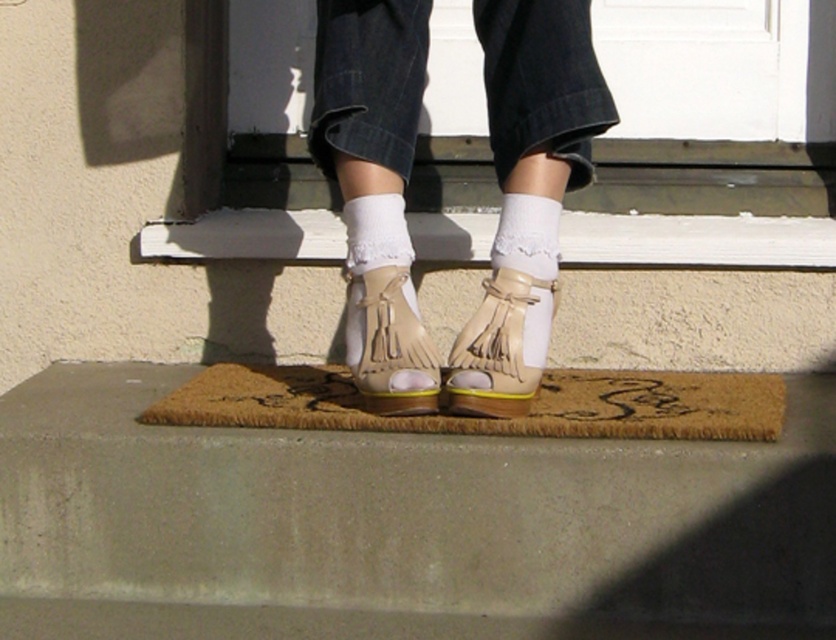
From the picture: Does beige suede sandals at center appear on the right side of beige suede fringe sandal at center?

In fact, beige suede sandals at center is to the left of beige suede fringe sandal at center.

Who is more forward, [399,179] or [520,333]?

Point [520,333]

Where is `beige suede sandals at center`? The height and width of the screenshot is (640, 836). beige suede sandals at center is located at coordinates (375, 179).

Is brown coir mat at center wider than white lace sock at center?

Indeed, brown coir mat at center has a greater width compared to white lace sock at center.

Can you confirm if brown coir mat at center is positioned to the right of white lace sock at center?

No, brown coir mat at center is not to the right of white lace sock at center.

Between point (636, 410) and point (554, 241), which one is positioned in front?

Point (636, 410) is in front.

Identify the location of brown coir mat at center. Image resolution: width=836 pixels, height=640 pixels. (487, 417).

Is beige suede sandals at center to the left of brown coir mat at center from the viewer's perspective?

Indeed, beige suede sandals at center is positioned on the left side of brown coir mat at center.

Is beige suede sandals at center taller than brown coir mat at center?

Yes, beige suede sandals at center is taller than brown coir mat at center.

Does point (552, 177) come behind point (679, 381)?

No, (552, 177) is in front of (679, 381).

Locate an element on the screen. beige suede sandals at center is located at coordinates (375, 179).